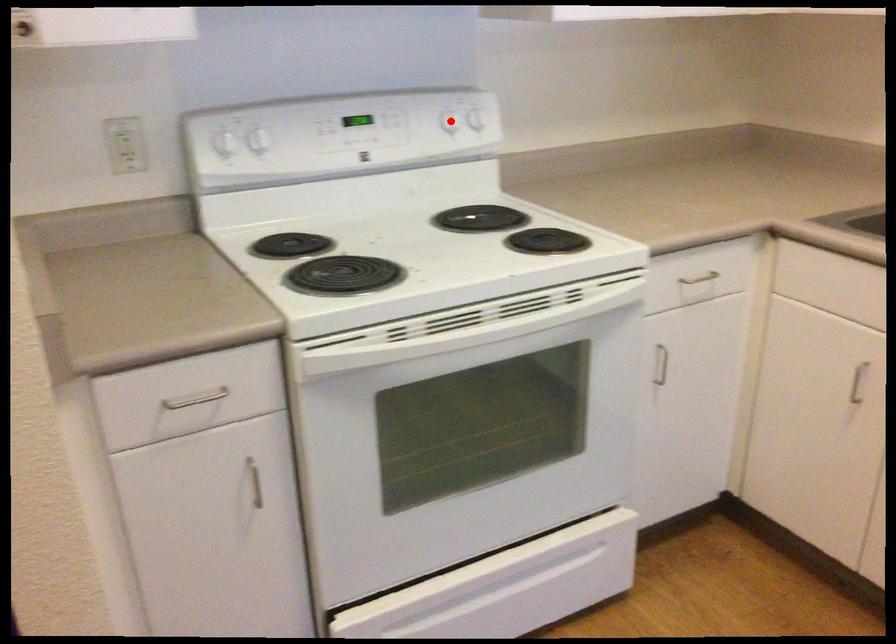
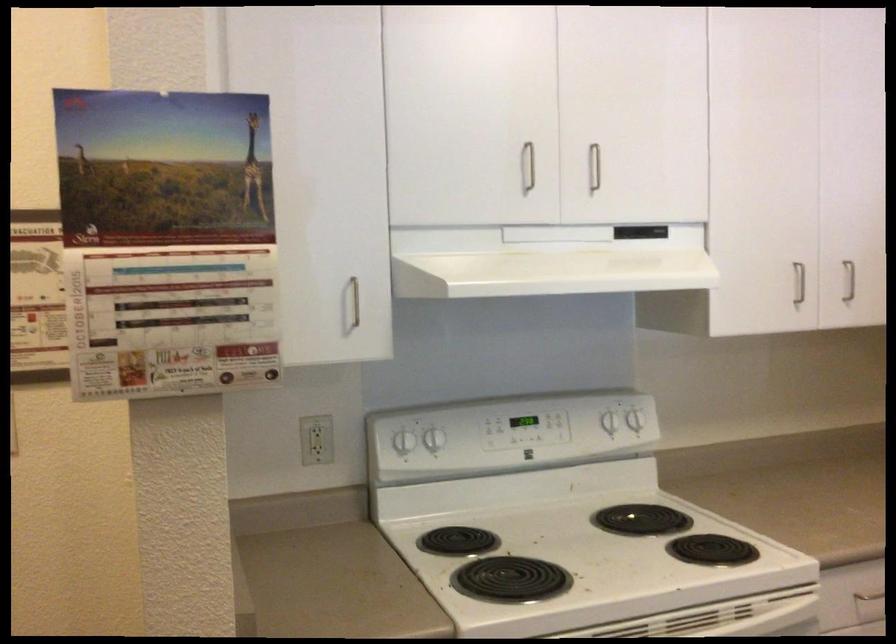
Find the pixel in the second image that matches the highlighted location in the first image.

(608, 422)